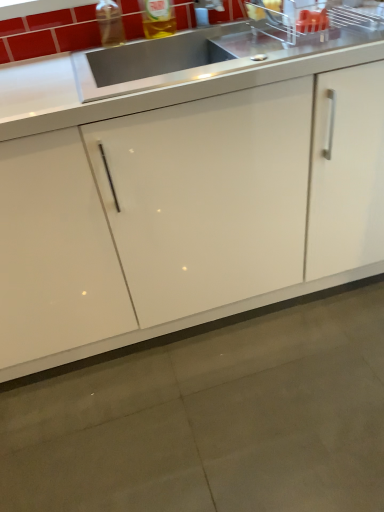
Question: Is transparent plastic bottle at upper left taller than translucent plastic bottle at upper center?

Choices:
 (A) no
 (B) yes

Answer: (A)

Question: Can translucent plastic bottle at upper center be found inside transparent plastic bottle at upper left?

Choices:
 (A) no
 (B) yes

Answer: (A)

Question: Considering the relative sizes of transparent plastic bottle at upper left and translucent plastic bottle at upper center in the image provided, is transparent plastic bottle at upper left smaller than translucent plastic bottle at upper center?

Choices:
 (A) no
 (B) yes

Answer: (B)

Question: Is the position of transparent plastic bottle at upper left more distant than that of translucent plastic bottle at upper center?

Choices:
 (A) no
 (B) yes

Answer: (B)

Question: Considering the relative sizes of transparent plastic bottle at upper left and translucent plastic bottle at upper center in the image provided, is transparent plastic bottle at upper left wider than translucent plastic bottle at upper center?

Choices:
 (A) no
 (B) yes

Answer: (A)

Question: From a real-world perspective, is transparent plastic bottle at upper left physically located above or below satin steel sink at upper center?

Choices:
 (A) below
 (B) above

Answer: (B)

Question: From the image's perspective, relative to satin steel sink at upper center, is transparent plastic bottle at upper left above or below?

Choices:
 (A) below
 (B) above

Answer: (B)

Question: Do you think transparent plastic bottle at upper left is within satin steel sink at upper center, or outside of it?

Choices:
 (A) outside
 (B) inside

Answer: (A)

Question: Looking at their shapes, would you say transparent plastic bottle at upper left is wider or thinner than satin steel sink at upper center?

Choices:
 (A) thin
 (B) wide

Answer: (A)

Question: Is white glossy cabinet at center taller or shorter than transparent plastic bottle at upper left?

Choices:
 (A) short
 (B) tall

Answer: (B)

Question: In terms of size, does white glossy cabinet at center appear bigger or smaller than transparent plastic bottle at upper left?

Choices:
 (A) small
 (B) big

Answer: (B)

Question: In the image, is white glossy cabinet at center positioned in front of or behind transparent plastic bottle at upper left?

Choices:
 (A) behind
 (B) front

Answer: (B)

Question: From a real-world perspective, is white glossy cabinet at center above or below transparent plastic bottle at upper left?

Choices:
 (A) above
 (B) below

Answer: (B)

Question: Considering their positions, is satin steel sink at upper center located in front of or behind white glossy cabinet at center?

Choices:
 (A) behind
 (B) front

Answer: (A)

Question: Is point (339, 46) positioned closer to the camera than point (162, 330)?

Choices:
 (A) closer
 (B) farther

Answer: (A)